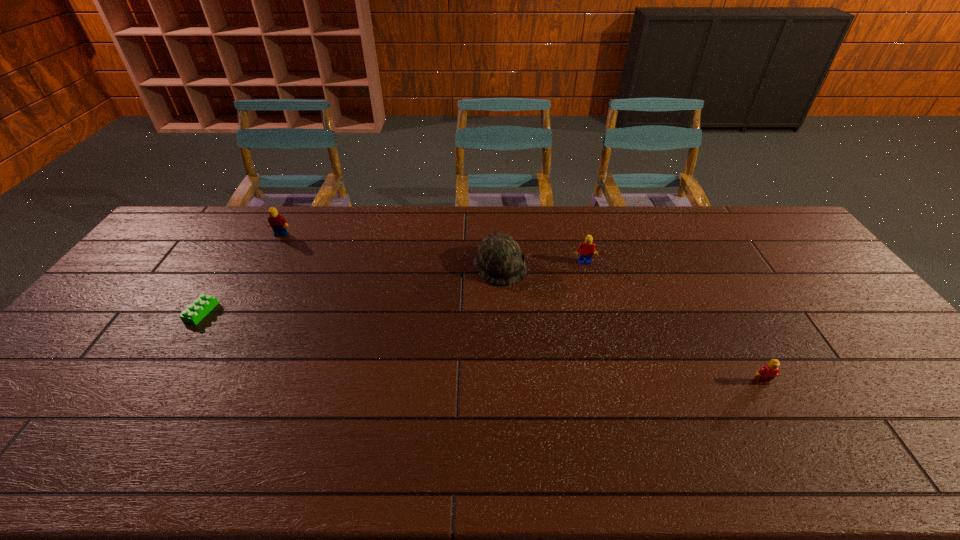
The image size is (960, 540). I want to click on free space between the second nearest Lego and the nearest Lego, so click(x=481, y=347).

Image resolution: width=960 pixels, height=540 pixels. I want to click on object that is the closest to the third object from left to right, so click(x=586, y=249).

This screenshot has height=540, width=960. In order to click on object that can be found as the second closest to the rightmost Lego in this screenshot , I will do `click(499, 260)`.

Identify which Lego is located as the nearest to the third farthest Lego. Please provide its 2D coordinates. Your answer should be formatted as a tuple, i.e. [(x, y)], where the tuple contains the x and y coordinates of a point satisfying the conditions above.

[(278, 223)]

Where is `Lego that is the closest to the third Lego from left to right`? This screenshot has height=540, width=960. Lego that is the closest to the third Lego from left to right is located at coordinates (769, 371).